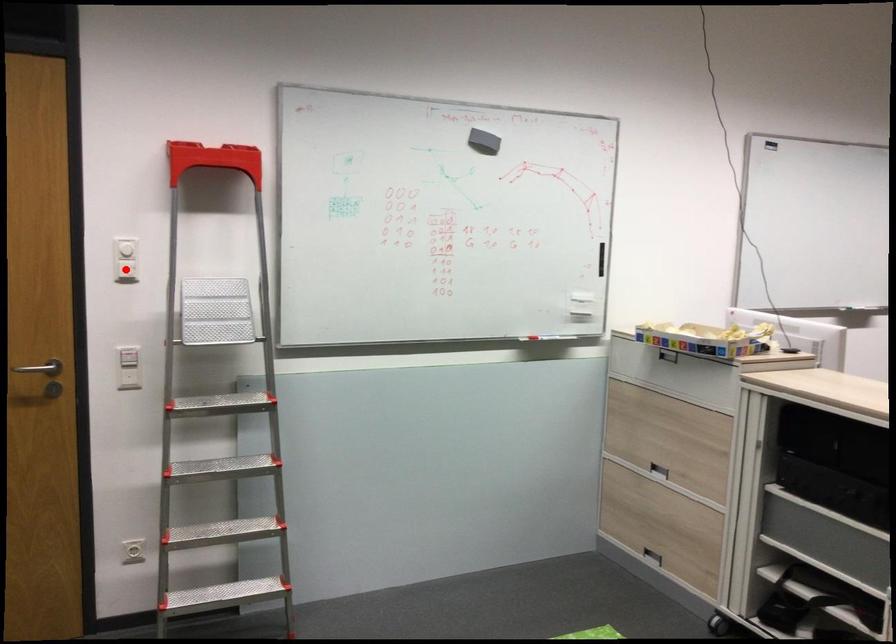
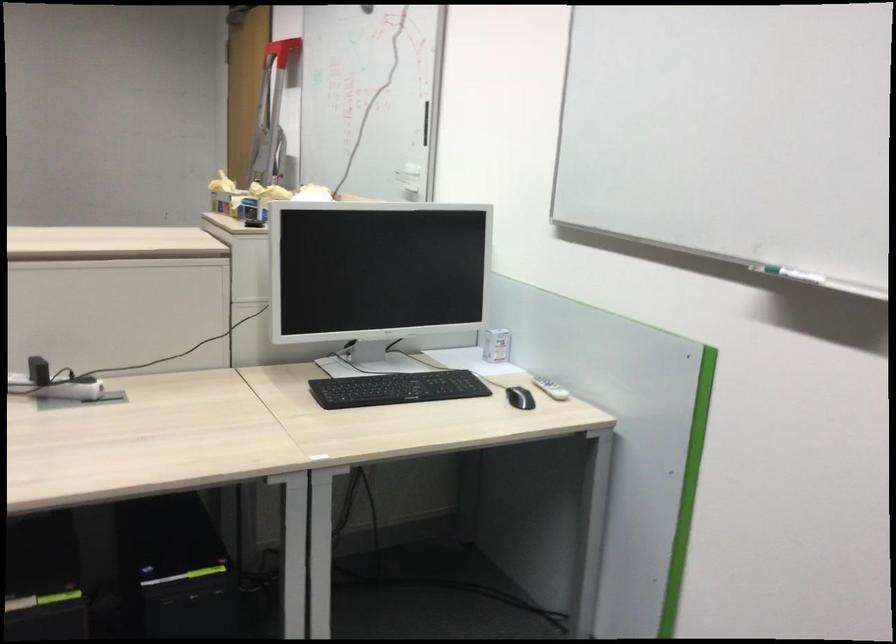
Question: I am providing you with two images of the same scene from different viewpoints. A red point is marked on the first image. Can you still see the location of the red point in image 2?

Choices:
 (A) Yes
 (B) No

Answer: (B)